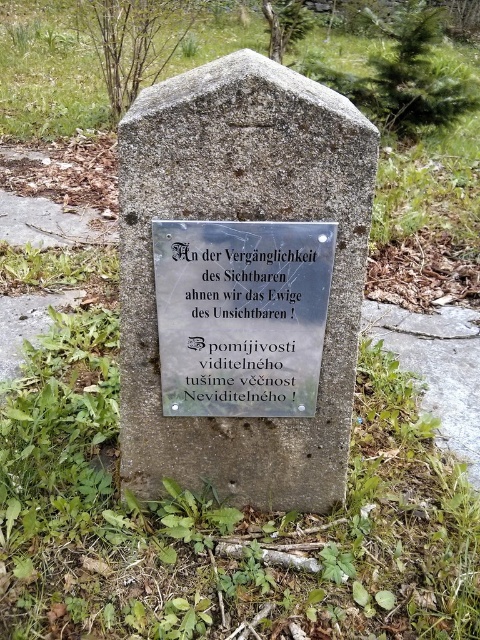
In the scene shown: Who is shorter, smooth stone gravestone at center or silver metallic plaque at center?

Standing shorter between the two is silver metallic plaque at center.

Where is `smooth stone gravestone at center`? This screenshot has width=480, height=640. smooth stone gravestone at center is located at coordinates (244, 218).

Is green grass at center to the left of silver metallic plaque at center from the viewer's perspective?

In fact, green grass at center is to the right of silver metallic plaque at center.

Which is more to the left, green grass at center or silver metallic plaque at center?

silver metallic plaque at center

Which is behind, point (164, 72) or point (312, 243)?

Point (164, 72)

You are a GUI agent. You are given a task and a screenshot of the screen. Output one action in this format:
    pyautogui.click(x=<x>, y=<y>)
    Task: Click on the green grass at center
    
    Given the screenshot: What is the action you would take?
    pyautogui.click(x=47, y=76)

Between point (287, 212) and point (478, 157), which one is positioned behind?

Point (478, 157)

Measure the distance between smooth stone gravestone at center and camera.

They are 1.29 meters apart.

Is point (156, 131) in front of point (253, 28)?

Yes.

At what (x,y) coordinates should I click in order to perform the action: click on smooth stone gravestone at center. Please return your answer as a coordinate pair (x, y). Looking at the image, I should click on (244, 218).